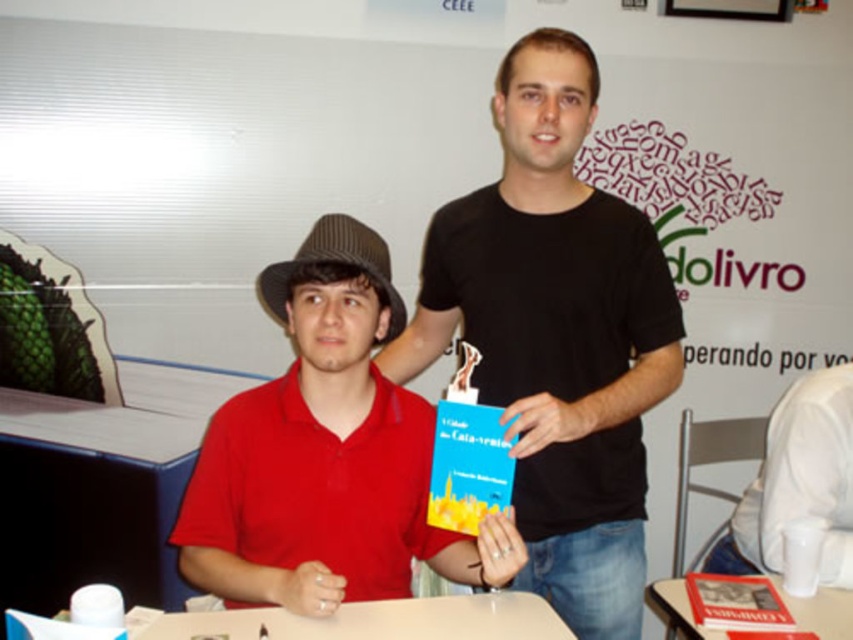
Can you confirm if brown woven cowboy hat at center is shorter than white glossy table at lower right?

No.

Does point (366, 264) come farther from viewer compared to point (799, 609)?

No, it is in front of (799, 609).

In order to click on brown woven cowboy hat at center in this screenshot , I will do (x=334, y=260).

Does matte red shirt at center appear on the right side of white glossy table at lower right?

No, matte red shirt at center is not to the right of white glossy table at lower right.

Locate an element on the screen. matte red shirt at center is located at coordinates (326, 454).

Which is below, black matte t-shirt at center or brown woven cowboy hat at center?

black matte t-shirt at center is lower down.

Looking at this image, can you confirm if black matte t-shirt at center is shorter than brown woven cowboy hat at center?

No, black matte t-shirt at center is not shorter than brown woven cowboy hat at center.

This screenshot has height=640, width=853. What are the coordinates of `black matte t-shirt at center` in the screenshot? It's located at (556, 336).